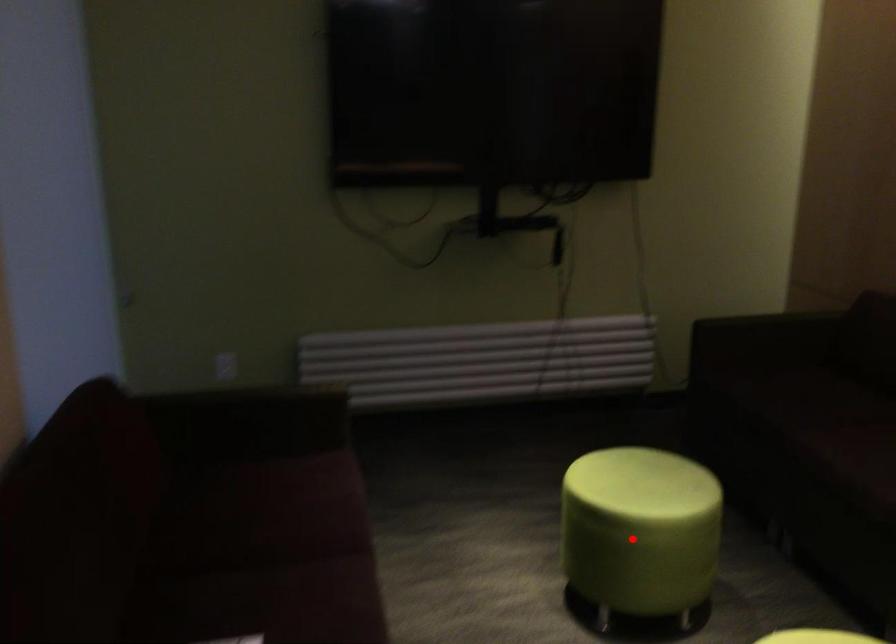
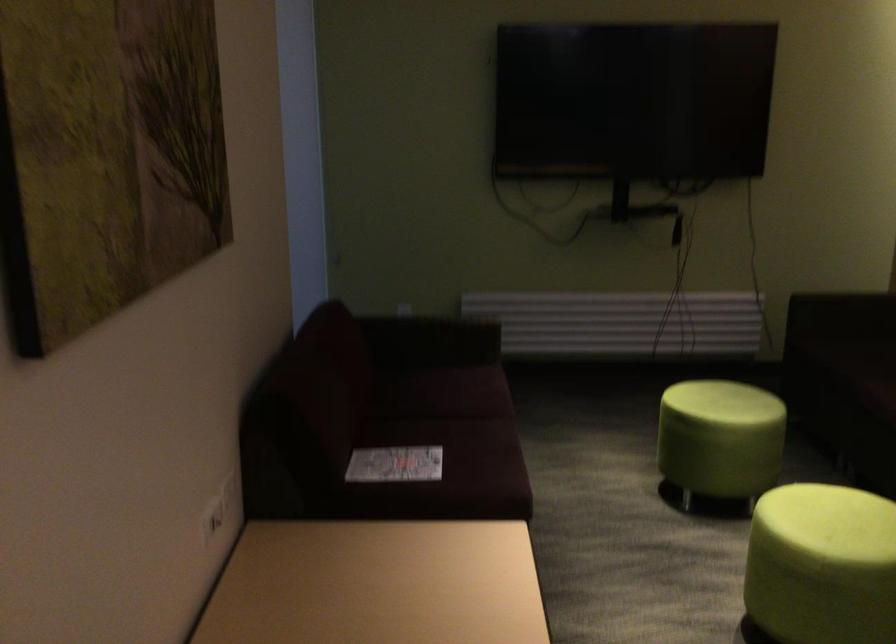
Question: I am providing you with two images of the same scene from different viewpoints. Image1 has a red point marked. In image2, the corresponding 3D location appears at what relative position? Reply with the corresponding letter.

Choices:
 (A) Closer
 (B) Farther

Answer: (B)